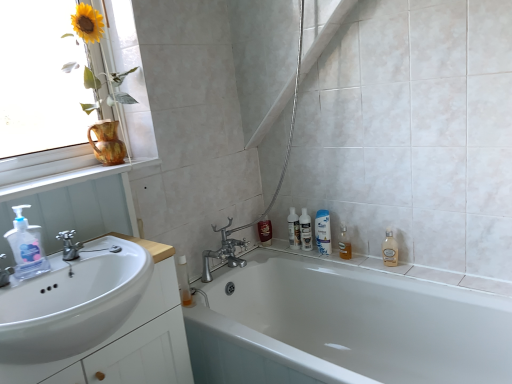
At what (x,y) coordinates should I click in order to perform the action: click on vacant area located to the right-hand side of shiny brown bottle at center, which is counted as the 3th toiletry, starting from the right. Please return your answer as a coordinate pair (x, y). The image size is (512, 384). Looking at the image, I should click on (286, 243).